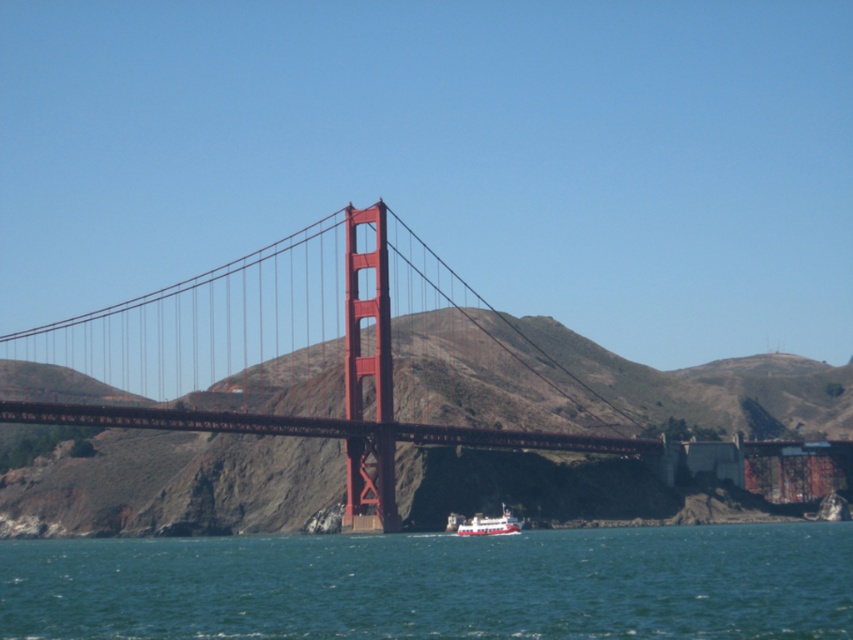
You are a photographer planning to take a photo of the Golden Gate Bridge. You want to ensure the blue water at lower center and the white plastic boat at lower center are both in the frame. Based on their positions, which object should you place closer to the left side of your camera viewfinder?

The blue water at lower center is positioned on the left side of the white plastic boat at lower center, so you should place the blue water at lower center closer to the left side of your camera viewfinder to capture both objects in the frame.

You are a photographer planning to take a photo of the Golden Gate Bridge. You notice two points marked in the image. One is at point (73, 417) and the other at point (505, 621). Which point is closer to the foreground of the image?

Point (505, 621) is closer to the foreground because it is in front of point (73, 417).

From the picture: You are a photographer planning to capture the Golden Gate Bridge with the blue water at lower center and the white plastic boat at lower center in the foreground. Which object should you focus on first if you want to ensure both are in sharp focus?

The blue water at lower center is bigger than the white plastic boat at lower center, so focusing on the blue water at lower center first will help ensure both are in sharp focus since it is larger and closer to the camera.